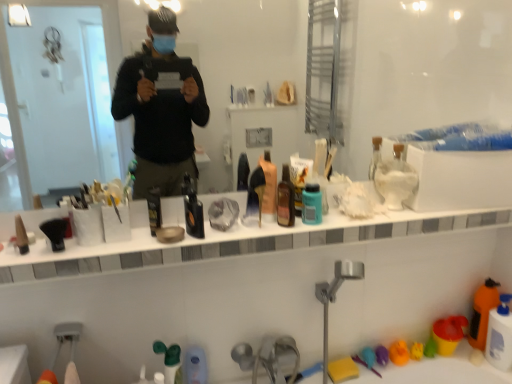
Image resolution: width=512 pixels, height=384 pixels. Identify the location of vacant area situated to the left side of brown glass bottle at center, the second mouthwash in the right-to-left sequence. (238, 231).